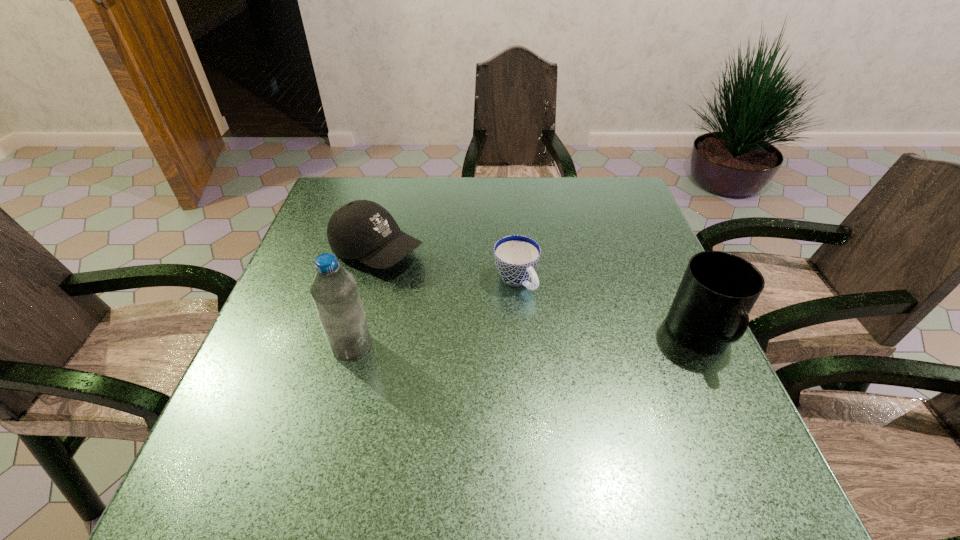
I want to click on vacant space on the desktop that is between the tallest object and the second tallest object and is positioned on the front-facing side of the baseball cap, so click(x=562, y=341).

Locate an element on the screen. The image size is (960, 540). vacant space on the desktop that is between the water bottle and the mug and is positioned on the side of the second object from right to left with the handle is located at coordinates (570, 340).